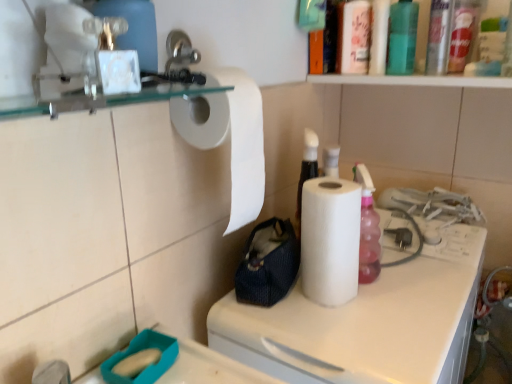
Question: From the image's perspective, would you say translucent plastic bottle at upper right, the second bottle in the back-to-front sequence, is positioned over white matte paper towel at upper left, which is counted as the 1th paper towel, starting from the left?

Choices:
 (A) yes
 (B) no

Answer: (A)

Question: Considering the relative sizes of translucent plastic bottle at upper right, the second bottle in the back-to-front sequence, and white matte paper towel at upper left, the second paper towel in the right-to-left sequence, in the image provided, is translucent plastic bottle at upper right, the second bottle in the back-to-front sequence, smaller than white matte paper towel at upper left, the second paper towel in the right-to-left sequence,?

Choices:
 (A) yes
 (B) no

Answer: (A)

Question: Is translucent plastic bottle at upper right, the second bottle in the back-to-front sequence, not inside white matte paper towel at upper left, the second paper towel in the right-to-left sequence?

Choices:
 (A) no
 (B) yes

Answer: (B)

Question: Does translucent plastic bottle at upper right, positioned as the first bottle in front-to-back order, have a greater width compared to white matte paper towel at upper left, which is counted as the 1th paper towel, starting from the left?

Choices:
 (A) no
 (B) yes

Answer: (A)

Question: Is translucent plastic bottle at upper right, the second bottle in the back-to-front sequence, to the right of white matte paper towel at upper left, the second paper towel in the right-to-left sequence, from the viewer's perspective?

Choices:
 (A) no
 (B) yes

Answer: (B)

Question: Is translucent plastic bottle at upper right, the second bottle in the back-to-front sequence, positioned behind white matte paper towel at upper left, which is counted as the 1th paper towel, starting from the left?

Choices:
 (A) yes
 (B) no

Answer: (A)

Question: Is the depth of white matte paper towel at center less than that of white matte paper towel at upper left, which is counted as the 1th paper towel, starting from the left?

Choices:
 (A) no
 (B) yes

Answer: (B)

Question: Is white matte paper towel at center at the right side of white matte paper towel at upper left, which is counted as the 1th paper towel, starting from the left?

Choices:
 (A) yes
 (B) no

Answer: (A)

Question: Can you confirm if white matte paper towel at center is smaller than white matte paper towel at upper left, the second paper towel in the right-to-left sequence?

Choices:
 (A) yes
 (B) no

Answer: (B)

Question: Can you confirm if white matte paper towel at center is shorter than white matte paper towel at upper left, the second paper towel in the right-to-left sequence?

Choices:
 (A) yes
 (B) no

Answer: (B)

Question: From the image's perspective, does white matte paper towel at center appear higher than white matte paper towel at upper left, which is counted as the 1th paper towel, starting from the left?

Choices:
 (A) no
 (B) yes

Answer: (A)

Question: Is white matte paper towel at center wider than white matte paper towel at upper left, the second paper towel in the right-to-left sequence?

Choices:
 (A) no
 (B) yes

Answer: (B)

Question: Is translucent plastic bottle at upper right, the second bottle in the back-to-front sequence, next to navy blue fabric pouch at center and touching it?

Choices:
 (A) no
 (B) yes

Answer: (A)